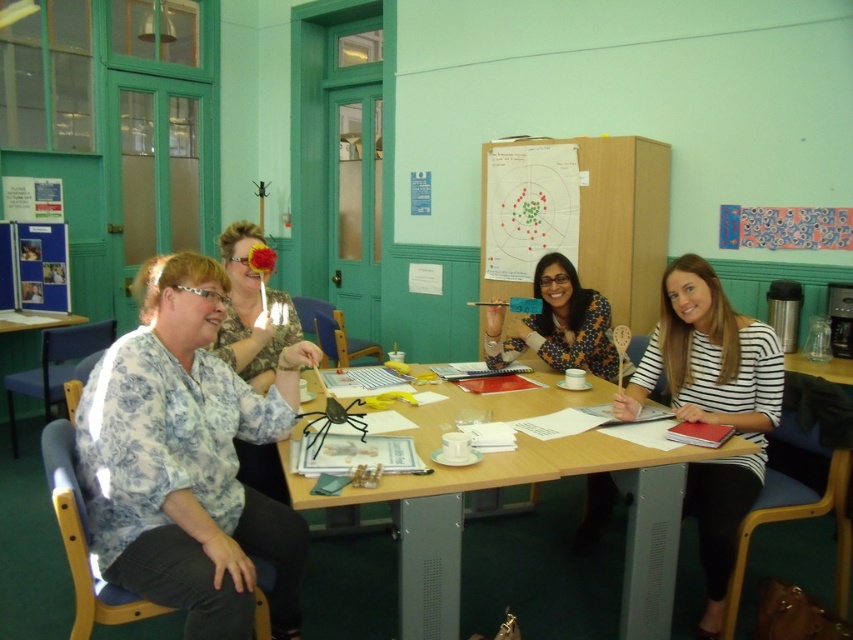
Is white striped shirt at right shorter than printed fabric blouse at center?

No.

Between point (757, 353) and point (598, 509), which one is positioned behind?

Positioned behind is point (598, 509).

Is point (697, 362) closer to viewer compared to point (560, 360)?

Yes.

Locate an element on the screen. white striped shirt at right is located at coordinates (711, 406).

Is point (636, 532) closer to viewer compared to point (267, 275)?

Yes.

Which of these two, wooden table at center or floral blouse at left, stands shorter?

wooden table at center

The height and width of the screenshot is (640, 853). In order to click on wooden table at center in this screenshot , I will do `click(519, 483)`.

The image size is (853, 640). Identify the location of wooden table at center. (519, 483).

Where is `wooden table at center`? The image size is (853, 640). wooden table at center is located at coordinates (519, 483).

Which is behind, point (589, 445) or point (625, 378)?

Positioned behind is point (625, 378).

The height and width of the screenshot is (640, 853). I want to click on wooden table at center, so click(519, 483).